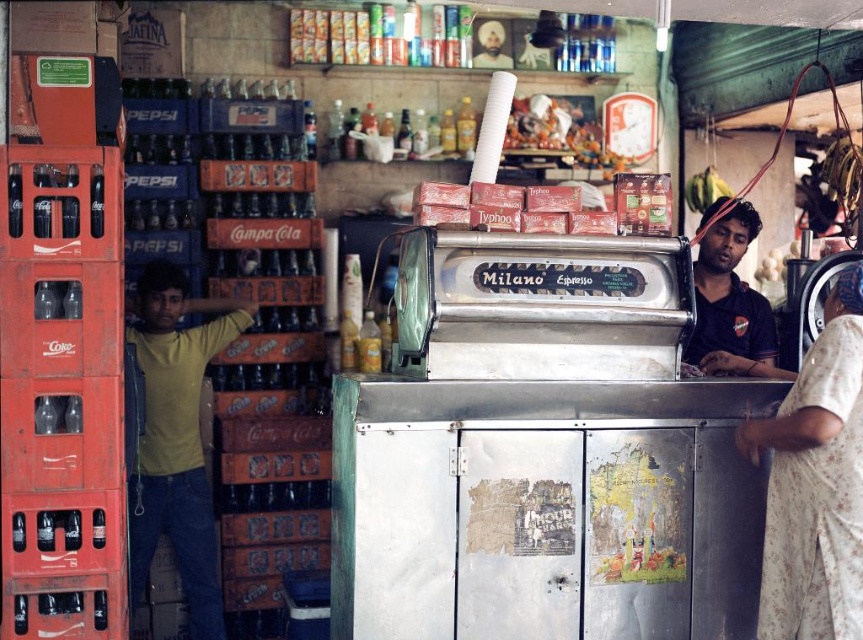
You are a customer in the shop and want to choose between the floral fabric dress at right and the dark blue shirt at right. Which item takes up less space on the rack?

The floral fabric dress at right occupies less space than the dark blue shirt at right, so it takes up less space on the rack.

You are a delivery person standing at the entrance of the shop and need to place a new crate. The shop owner says you can only place it in front of the point labeled as point [763,324]. Can you confirm if point [792,584] is a suitable location for the new crate?

Yes, point [792,584] is in front of point [763,324], so it is a suitable location for placing the new crate.